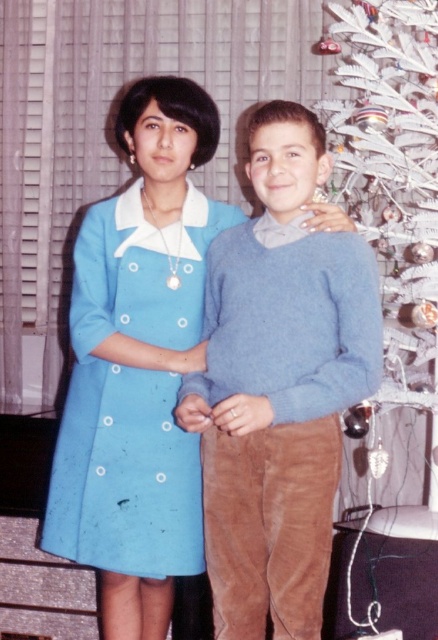
You are a delivery person who needs to place a large package in this room. The package is 1.2 meters wide. The light blue sweater at center and the white feather christmas tree at right are in the way. Which object should you move to make space?

The light blue sweater at center has a smaller size compared to white feather christmas tree at right, so you should move the light blue sweater at center to make space for the large package.

You are standing in the living room and want to move from the location of point (197,540) to the location of point (367,86). Is the path between these two points clear? Please explain using the scene description.

The path between point (197,540) and point (367,86) is clear because point (197,540) is in front of point (367,86), indicating there is no obstruction blocking the way between them.

You are a fashion designer analyzing the image. You need to decide which item would be more suitable for a winter fashion show. Based on the thickness of the light blue sweater at center and the matte blue dress at center, which one would you choose?

The light blue sweater at center is thinner than the matte blue dress at center, so the matte blue dress at center would be more suitable for a winter fashion show due to its thicker material.